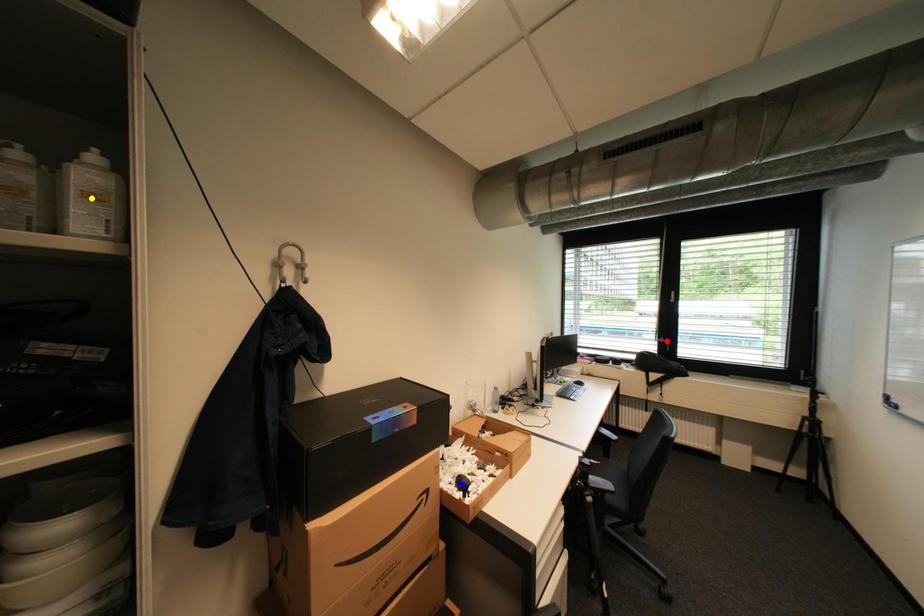
Order these from nearest to farthest:
- yellow point
- red point
- blue point

yellow point, blue point, red point